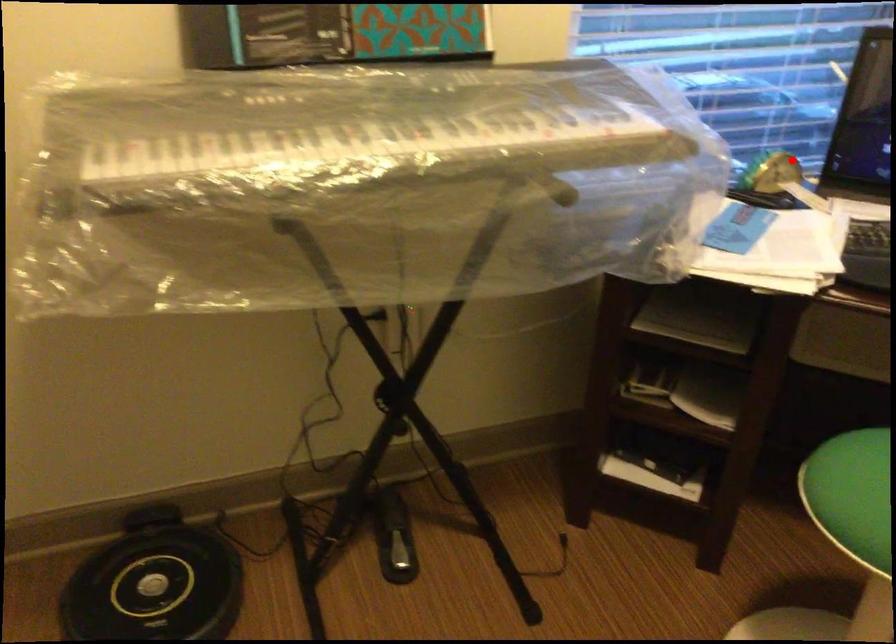
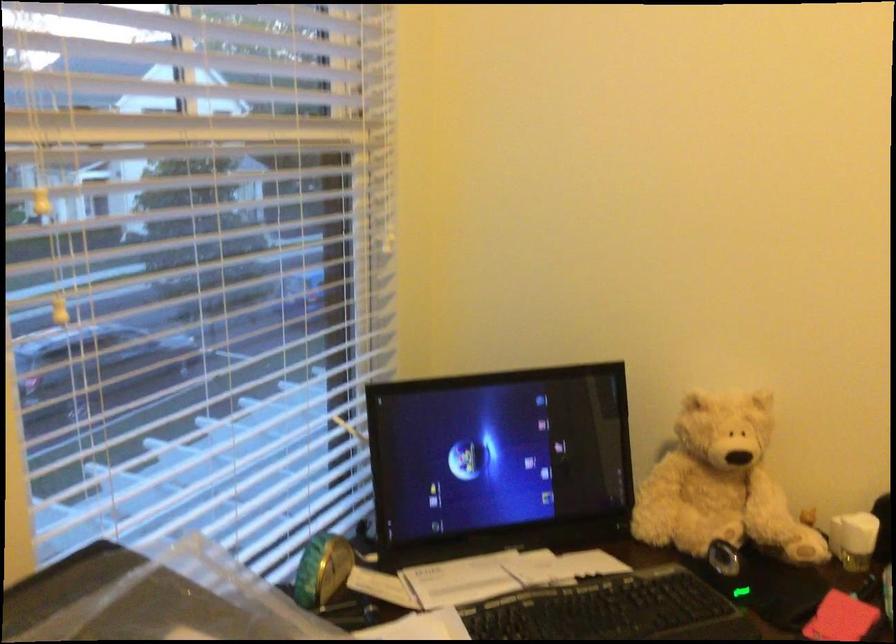
Question: I am providing you with two images of the same scene from different viewpoints. Image1 has a red point marked. In image2, the corresponding 3D location appears at what relative position? Reply with the corresponding letter.

Choices:
 (A) Closer
 (B) Farther

Answer: (A)